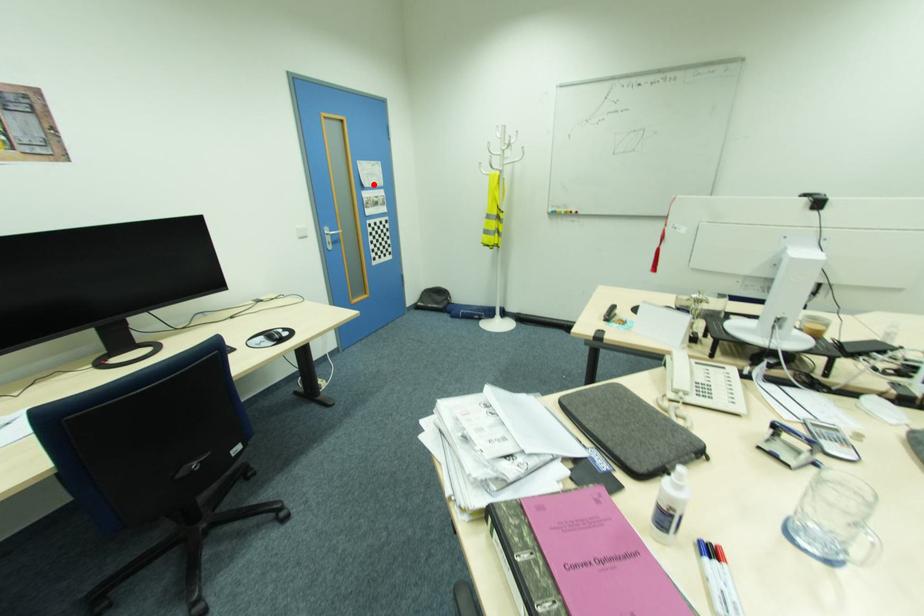
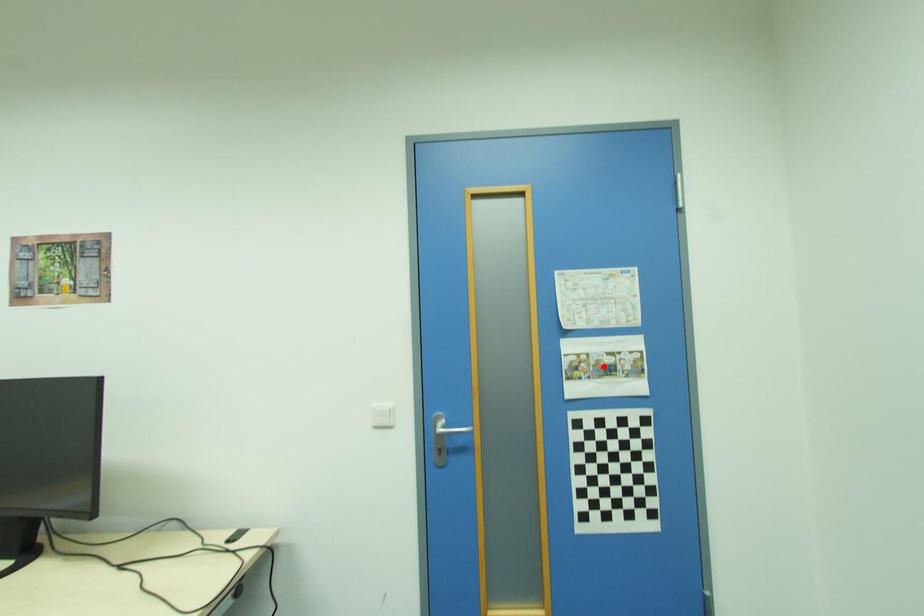
I am providing you with two images of the same scene from different viewpoints. A red point is marked on the first image and another point is marked on the second image. Do the highlighted points in image1 and image2 indicate the same real-world spot?

No